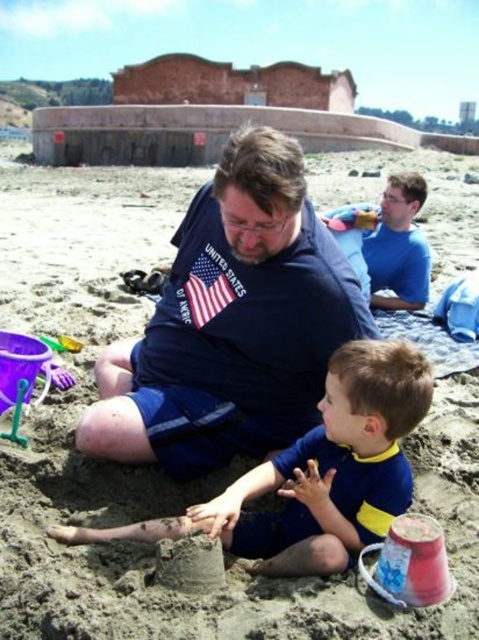
You are a photographer trying to capture a photo of the blue cotton shirt at center and the blue smooth shirt at upper right. Which shirt should you focus on first if you want to ensure both are in sharp focus?

You should focus on the blue cotton shirt at center first because it is closer to the camera than the blue smooth shirt at upper right, ensuring both will be in focus when using depth of field properly.

Consider the image. You are a photographer standing at the camera position. You want to take a photo of the blue cotton shirt at center. Can you reach it without moving your feet?

The blue cotton shirt at center is 2.11 meters away from camera, so yes, you can reach it without moving your feet since it is within a typical arm reach distance.